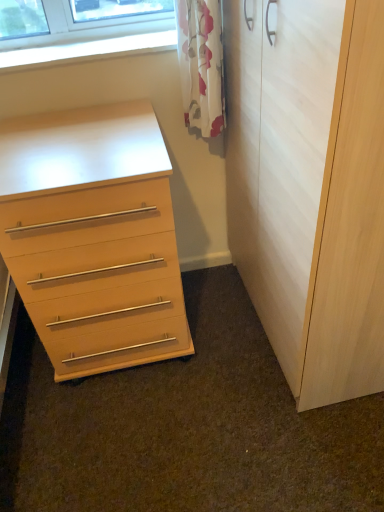
Question: From the image's perspective, is light wood/texture cupboard at right below light wood/finish chest of drawers at left?

Choices:
 (A) no
 (B) yes

Answer: (A)

Question: Does light wood/texture cupboard at right contain light wood/finish chest of drawers at left?

Choices:
 (A) no
 (B) yes

Answer: (A)

Question: Is light wood/texture cupboard at right closer to the viewer compared to light wood/finish chest of drawers at left?

Choices:
 (A) no
 (B) yes

Answer: (B)

Question: Is light wood/texture cupboard at right at the left side of light wood/finish chest of drawers at left?

Choices:
 (A) no
 (B) yes

Answer: (A)

Question: From the image's perspective, is light wood/texture cupboard at right above light wood/finish chest of drawers at left?

Choices:
 (A) no
 (B) yes

Answer: (B)

Question: Is light wood/texture cupboard at right behind light wood/finish chest of drawers at left?

Choices:
 (A) no
 (B) yes

Answer: (A)

Question: Is light wood/texture cupboard at right positioned behind white floral curtain at upper center?

Choices:
 (A) yes
 (B) no

Answer: (B)

Question: Is light wood/texture cupboard at right to the left of white floral curtain at upper center from the viewer's perspective?

Choices:
 (A) yes
 (B) no

Answer: (B)

Question: Is light wood/texture cupboard at right smaller than white floral curtain at upper center?

Choices:
 (A) yes
 (B) no

Answer: (B)

Question: From the image's perspective, is light wood/texture cupboard at right located above white floral curtain at upper center?

Choices:
 (A) no
 (B) yes

Answer: (A)

Question: Can you confirm if light wood/texture cupboard at right is bigger than white floral curtain at upper center?

Choices:
 (A) no
 (B) yes

Answer: (B)

Question: Would you say light wood/texture cupboard at right is a long distance from white floral curtain at upper center?

Choices:
 (A) no
 (B) yes

Answer: (A)

Question: Does light wood/finish chest of drawers at left come in front of white floral curtain at upper center?

Choices:
 (A) no
 (B) yes

Answer: (B)